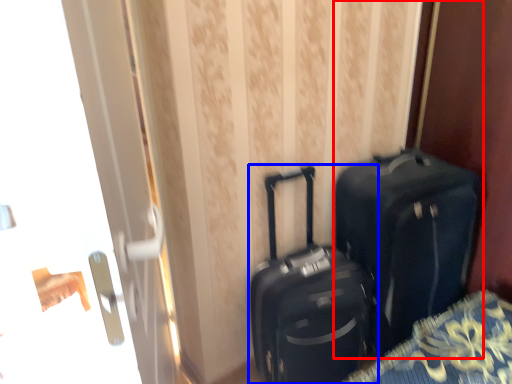
Question: Which object is further to the camera taking this photo, luggage and bags (highlighted by a red box) or suitcase (highlighted by a blue box)?

Choices:
 (A) luggage and bags
 (B) suitcase

Answer: (A)